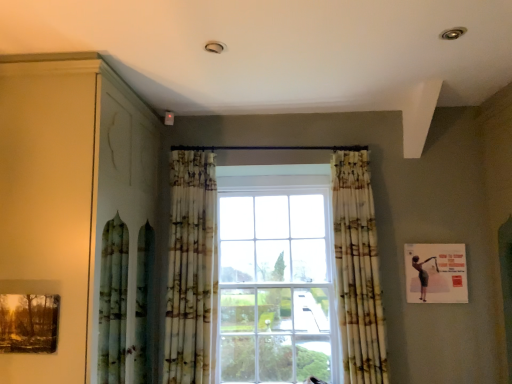
Question: Can we say matte wooden picture frame at lower left, which is the 1th picture frame from front to back, lies outside printed fabric curtain at center, which is the 1th curtain from left to right?

Choices:
 (A) yes
 (B) no

Answer: (A)

Question: Is matte wooden picture frame at lower left, the second picture frame positioned from the right, with printed fabric curtain at center, which is the 1th curtain from left to right?

Choices:
 (A) yes
 (B) no

Answer: (B)

Question: Is matte wooden picture frame at lower left, the 1th picture frame viewed from the left, to the right of printed fabric curtain at center, the second curtain in the right-to-left sequence, from the viewer's perspective?

Choices:
 (A) yes
 (B) no

Answer: (B)

Question: Is matte wooden picture frame at lower left, the 1th picture frame viewed from the left, to the left of printed fabric curtain at center, the second curtain in the right-to-left sequence, from the viewer's perspective?

Choices:
 (A) yes
 (B) no

Answer: (A)

Question: Can printed fabric curtain at center, which is the 1th curtain from left to right, be found inside matte wooden picture frame at lower left, the second picture frame positioned from the right?

Choices:
 (A) yes
 (B) no

Answer: (B)

Question: Is matte wooden picture frame at lower left, the second picture frame positioned from the right, closer to camera compared to printed fabric curtain at center, which is the 1th curtain from left to right?

Choices:
 (A) yes
 (B) no

Answer: (A)

Question: Is printed fabric curtain at center, the second curtain in the right-to-left sequence, thinner than printed fabric curtain at center, the second curtain when ordered from left to right?

Choices:
 (A) yes
 (B) no

Answer: (A)

Question: Is printed fabric curtain at center, acting as the 1th curtain starting from the right, a part of printed fabric curtain at center, the second curtain in the right-to-left sequence?

Choices:
 (A) no
 (B) yes

Answer: (A)

Question: From a real-world perspective, is printed fabric curtain at center, which is the 1th curtain from left to right, located beneath printed fabric curtain at center, the second curtain when ordered from left to right?

Choices:
 (A) yes
 (B) no

Answer: (B)

Question: From the image's perspective, is printed fabric curtain at center, the second curtain in the right-to-left sequence, above printed fabric curtain at center, acting as the 1th curtain starting from the right?

Choices:
 (A) no
 (B) yes

Answer: (B)

Question: Does printed fabric curtain at center, which is the 1th curtain from left to right, turn towards printed fabric curtain at center, the second curtain when ordered from left to right?

Choices:
 (A) no
 (B) yes

Answer: (A)

Question: Can you confirm if printed fabric curtain at center, the second curtain in the right-to-left sequence, is taller than printed fabric curtain at center, the second curtain when ordered from left to right?

Choices:
 (A) no
 (B) yes

Answer: (B)

Question: Is matte wooden picture frame at lower left, which is the 1th picture frame from front to back, facing towards printed fabric curtain at center, the second curtain when ordered from left to right?

Choices:
 (A) no
 (B) yes

Answer: (A)